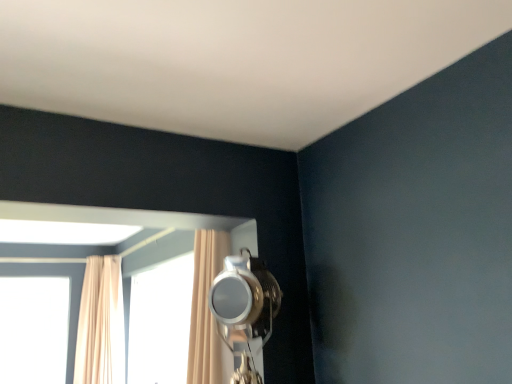
Locate an element on the screen. beige fabric curtain at left is located at coordinates (101, 324).

The height and width of the screenshot is (384, 512). What do you see at coordinates (101, 324) in the screenshot?
I see `beige fabric curtain at left` at bounding box center [101, 324].

Measure the distance between beige fabric curtain at left and camera.

They are 4.84 meters apart.

You are a GUI agent. You are given a task and a screenshot of the screen. Output one action in this format:
    pyautogui.click(x=<x>, y=<y>)
    Task: Click on the beige fabric curtain at left
    The image size is (512, 384).
    Given the screenshot: What is the action you would take?
    pyautogui.click(x=101, y=324)